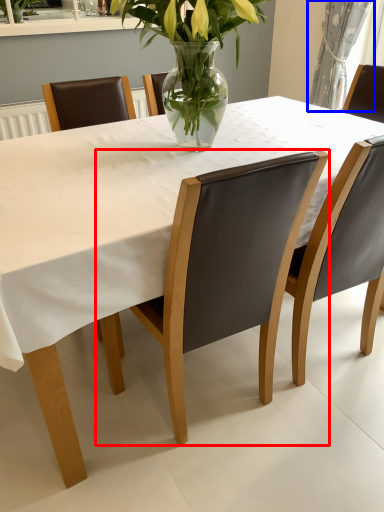
Question: Among these objects, which one is nearest to the camera, chair (highlighted by a red box) or curtain (highlighted by a blue box)?

Choices:
 (A) chair
 (B) curtain

Answer: (A)